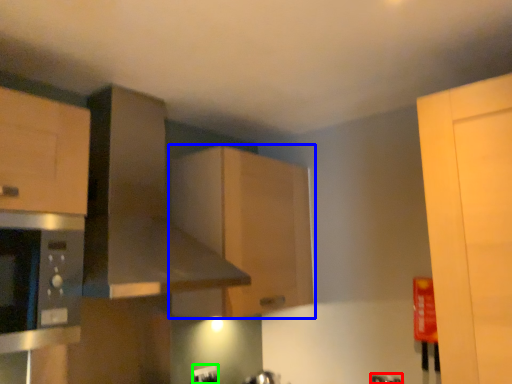
Question: Which is farther away from faucet (highlighted by a red box)? cabinetry (highlighted by a blue box) or electric outlet (highlighted by a green box)?

Choices:
 (A) cabinetry
 (B) electric outlet

Answer: (A)